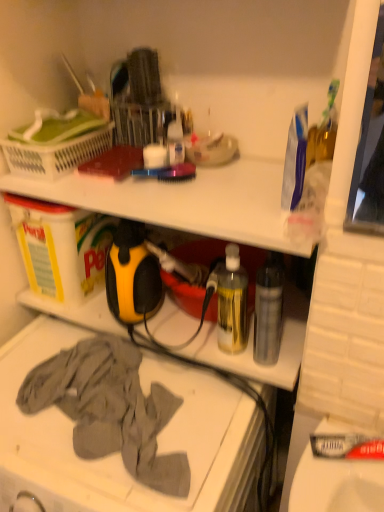
What do you see at coordinates (268, 310) in the screenshot? Image resolution: width=384 pixels, height=512 pixels. I see `transparent plastic bottle at center-right, which ranks as the 2th bottle in left-to-right order` at bounding box center [268, 310].

Find the location of `white plastic laundry basket at upper left`. white plastic laundry basket at upper left is located at coordinates (56, 153).

In order to click on translucent plastic bottle at center, placed as the 2th bottle when sorted from right to left in this screenshot , I will do `click(232, 302)`.

Visually, is transparent plastic bottle at center-right, which ranks as the 2th bottle in left-to-right order, positioned to the left or to the right of translucent plastic bottle at center, placed as the 2th bottle when sorted from right to left?

Based on their positions, transparent plastic bottle at center-right, which ranks as the 2th bottle in left-to-right order, is located to the right of translucent plastic bottle at center, placed as the 2th bottle when sorted from right to left.

Is transparent plastic bottle at center-right, acting as the 1th bottle starting from the right, oriented towards translucent plastic bottle at center, acting as the 1th bottle starting from the left?

No, transparent plastic bottle at center-right, acting as the 1th bottle starting from the right, is not oriented towards translucent plastic bottle at center, acting as the 1th bottle starting from the left.

You are a GUI agent. You are given a task and a screenshot of the screen. Output one action in this format:
    pyautogui.click(x=<x>, y=<y>)
    Task: Click on the bottle that appears above the transparent plastic bottle at center-right, acting as the 1th bottle starting from the right (from the image's perspective)
    
    Given the screenshot: What is the action you would take?
    click(x=232, y=302)

In the scene shown: Can translucent plastic bottle at center, placed as the 2th bottle when sorted from right to left, be found inside transparent plastic bottle at center-right, acting as the 1th bottle starting from the right?

Definitely not — translucent plastic bottle at center, placed as the 2th bottle when sorted from right to left, is not inside transparent plastic bottle at center-right, acting as the 1th bottle starting from the right.

Considering the relative sizes of translucent plastic bottle at center, acting as the 1th bottle starting from the left, and transparent plastic bottle at center-right, acting as the 1th bottle starting from the right, in the image provided, is translucent plastic bottle at center, acting as the 1th bottle starting from the left, shorter than transparent plastic bottle at center-right, acting as the 1th bottle starting from the right,?

No.

From the image's perspective, does translucent plastic bottle at center, acting as the 1th bottle starting from the left, appear higher than transparent plastic bottle at center-right, which ranks as the 2th bottle in left-to-right order?

Yes, from the image's perspective, translucent plastic bottle at center, acting as the 1th bottle starting from the left, is over transparent plastic bottle at center-right, which ranks as the 2th bottle in left-to-right order.

Where is `bottle that is behind the transparent plastic bottle at center-right, acting as the 1th bottle starting from the right`? bottle that is behind the transparent plastic bottle at center-right, acting as the 1th bottle starting from the right is located at coordinates (232, 302).

Considering the relative sizes of translucent plastic bottle at center, acting as the 1th bottle starting from the left, and transparent plastic bottle at center-right, acting as the 1th bottle starting from the right, in the image provided, is translucent plastic bottle at center, acting as the 1th bottle starting from the left, wider than transparent plastic bottle at center-right, acting as the 1th bottle starting from the right,?

Indeed, translucent plastic bottle at center, acting as the 1th bottle starting from the left, has a greater width compared to transparent plastic bottle at center-right, acting as the 1th bottle starting from the right.

Is white plastic laundry basket at upper left shorter than translucent plastic bottle at center, acting as the 1th bottle starting from the left?

Indeed, white plastic laundry basket at upper left has a lesser height compared to translucent plastic bottle at center, acting as the 1th bottle starting from the left.

Is white plastic laundry basket at upper left turned away from translucent plastic bottle at center, placed as the 2th bottle when sorted from right to left?

No, white plastic laundry basket at upper left's orientation is not away from translucent plastic bottle at center, placed as the 2th bottle when sorted from right to left.

Which of these two, white plastic laundry basket at upper left or translucent plastic bottle at center, placed as the 2th bottle when sorted from right to left, is bigger?

Bigger between the two is white plastic laundry basket at upper left.

Can you see white plastic laundry basket at upper left touching translucent plastic bottle at center, placed as the 2th bottle when sorted from right to left?

They are not placed beside each other.

Is point (136, 470) positioned in front of point (260, 300)?

Yes.

Based on the photo, visually, is gray cotton cloth at lower left positioned to the left or to the right of transparent plastic bottle at center-right, which ranks as the 2th bottle in left-to-right order?

Based on their positions, gray cotton cloth at lower left is located to the left of transparent plastic bottle at center-right, which ranks as the 2th bottle in left-to-right order.

From the image's perspective, is gray cotton cloth at lower left above or below transparent plastic bottle at center-right, acting as the 1th bottle starting from the right?

gray cotton cloth at lower left is situated lower than transparent plastic bottle at center-right, acting as the 1th bottle starting from the right, in the image.

From the image's perspective, which one is positioned higher, transparent plastic bottle at center-right, acting as the 1th bottle starting from the right, or gray cotton cloth at lower left?

transparent plastic bottle at center-right, acting as the 1th bottle starting from the right.

Can you tell me how much transparent plastic bottle at center-right, acting as the 1th bottle starting from the right, and gray cotton cloth at lower left differ in facing direction?

The angle between the facing direction of transparent plastic bottle at center-right, acting as the 1th bottle starting from the right, and the facing direction of gray cotton cloth at lower left is 1.96 degrees.

Is transparent plastic bottle at center-right, which ranks as the 2th bottle in left-to-right order, bigger or smaller than gray cotton cloth at lower left?

In the image, transparent plastic bottle at center-right, which ranks as the 2th bottle in left-to-right order, appears to be smaller than gray cotton cloth at lower left.

Is white plastic laundry basket at upper left to the left of transparent plastic bottle at center-right, which ranks as the 2th bottle in left-to-right order, from the viewer's perspective?

Yes.

In the scene shown: Is white plastic laundry basket at upper left surrounding transparent plastic bottle at center-right, acting as the 1th bottle starting from the right?

That's incorrect, transparent plastic bottle at center-right, acting as the 1th bottle starting from the right, is not inside white plastic laundry basket at upper left.

Which is in front, point (46, 152) or point (280, 330)?

The point (280, 330) is closer.

Who is bigger, white plastic laundry basket at upper left or transparent plastic bottle at center-right, which ranks as the 2th bottle in left-to-right order?

Bigger between the two is white plastic laundry basket at upper left.

How many degrees apart are the facing directions of transparent plastic bottle at center-right, acting as the 1th bottle starting from the right, and white plastic laundry basket at upper left?

5.53 degrees.

This screenshot has width=384, height=512. Find the location of `laundry basket that is above the transparent plastic bottle at center-right, acting as the 1th bottle starting from the right (from a real-world perspective)`. laundry basket that is above the transparent plastic bottle at center-right, acting as the 1th bottle starting from the right (from a real-world perspective) is located at coordinates (56, 153).

Consider the image. Which is correct: transparent plastic bottle at center-right, which ranks as the 2th bottle in left-to-right order, is inside white plastic laundry basket at upper left, or outside of it?

transparent plastic bottle at center-right, which ranks as the 2th bottle in left-to-right order, is spatially situated outside white plastic laundry basket at upper left.

Find the location of a particular element. bottle that is above the transparent plastic bottle at center-right, acting as the 1th bottle starting from the right (from the image's perspective) is located at coordinates (232, 302).

The height and width of the screenshot is (512, 384). I want to click on bottle lying in front of the translucent plastic bottle at center, acting as the 1th bottle starting from the left, so pos(268,310).

Looking at the image, which one is located further to transparent plastic bottle at center-right, acting as the 1th bottle starting from the right, white plastic laundry basket at upper left or translucent plastic bottle at center, placed as the 2th bottle when sorted from right to left?

white plastic laundry basket at upper left is positioned further to the anchor transparent plastic bottle at center-right, acting as the 1th bottle starting from the right.

Based on their spatial positions, is translucent plastic bottle at center, acting as the 1th bottle starting from the left, or transparent plastic bottle at center-right, acting as the 1th bottle starting from the right, closer to white plastic laundry basket at upper left?

translucent plastic bottle at center, acting as the 1th bottle starting from the left.

Based on their spatial positions, is white plastic laundry basket at upper left or gray cotton cloth at lower left further from translucent plastic bottle at center, placed as the 2th bottle when sorted from right to left?

Based on the image, white plastic laundry basket at upper left appears to be further to translucent plastic bottle at center, placed as the 2th bottle when sorted from right to left.

When comparing their distances from gray cotton cloth at lower left, does translucent plastic bottle at center, acting as the 1th bottle starting from the left, or transparent plastic bottle at center-right, which ranks as the 2th bottle in left-to-right order, seem closer?

The object closer to gray cotton cloth at lower left is translucent plastic bottle at center, acting as the 1th bottle starting from the left.

Based on the photo, considering their positions, is transparent plastic bottle at center-right, acting as the 1th bottle starting from the right, positioned closer to translucent plastic bottle at center, placed as the 2th bottle when sorted from right to left, than gray cotton cloth at lower left?

transparent plastic bottle at center-right, acting as the 1th bottle starting from the right, is positioned closer to the anchor translucent plastic bottle at center, placed as the 2th bottle when sorted from right to left.

In the scene shown: Looking at the image, which one is located further to translucent plastic bottle at center, acting as the 1th bottle starting from the left, transparent plastic bottle at center-right, which ranks as the 2th bottle in left-to-right order, or white plastic laundry basket at upper left?

Based on the image, white plastic laundry basket at upper left appears to be further to translucent plastic bottle at center, acting as the 1th bottle starting from the left.

Looking at the image, which one is located further to white plastic laundry basket at upper left, gray cotton cloth at lower left or transparent plastic bottle at center-right, acting as the 1th bottle starting from the right?

The object further to white plastic laundry basket at upper left is transparent plastic bottle at center-right, acting as the 1th bottle starting from the right.

Looking at the image, which one is located closer to white plastic laundry basket at upper left, gray cotton cloth at lower left or translucent plastic bottle at center, placed as the 2th bottle when sorted from right to left?

translucent plastic bottle at center, placed as the 2th bottle when sorted from right to left, lies closer to white plastic laundry basket at upper left than the other object.

Locate an element on the screen. bottle between gray cotton cloth at lower left and transparent plastic bottle at center-right, which ranks as the 2th bottle in left-to-right order, from left to right is located at coordinates (232, 302).

You are a GUI agent. You are given a task and a screenshot of the screen. Output one action in this format:
    pyautogui.click(x=<x>, y=<y>)
    Task: Click on the bottle between white plastic laundry basket at upper left and transparent plastic bottle at center-right, acting as the 1th bottle starting from the right, from left to right
    
    Given the screenshot: What is the action you would take?
    pyautogui.click(x=232, y=302)